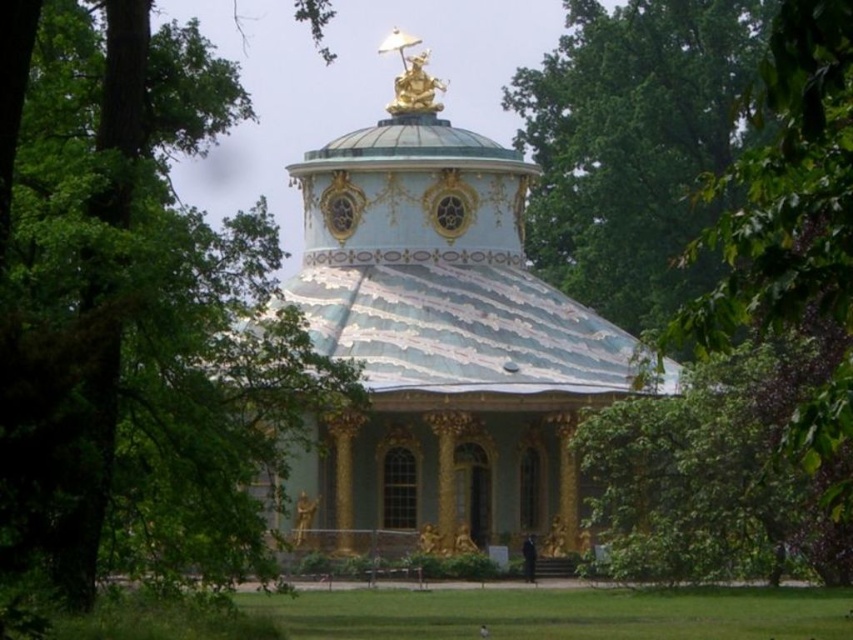
From the picture: You are standing in the park and want to take a photo of the pavilion. Where should you position yourself to ensure the green leafy tree at upper left is in the background?

To have the green leafy tree at upper left in the background, position yourself facing the pavilion while standing to the right side of the structure, as the tree is located at the upper left corner of the scene.

You are an architect designing a new garden layout and want to place a statue between the porcelain dome at center and the green leafy tree at upper center. Based on their positions, which side of the tree should the statue be placed on?

The porcelain dome at center is positioned on the left side of the green leafy tree at upper center, so the statue should be placed on the left side of the tree.